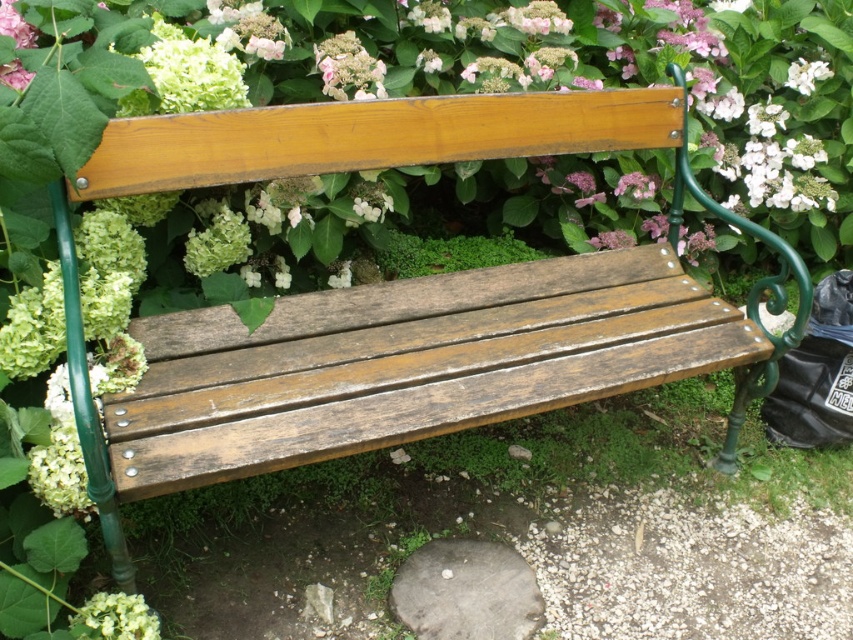
You are planning to take a photo of the wooden bench at center and the white matte flower at upper center. To ensure both are in focus, where should you position yourself relative to them?

You should position yourself in front of the wooden bench at center since it is closer to you than the white matte flower at upper center, ensuring both are in focus by focusing on the bench.

You are a gardener who wants to plant a new flower in the garden. You have two options from the image, the white matte flower at lower left and the pink matte flower at upper center. Which flower has a wider spread when fully grown?

The white matte flower at lower left has a wider spread than the pink matte flower at upper center because its width is larger according to the description.

You are standing in the garden and want to pick both the white matte flower at lower left and the pink matte flower at upper center. Which flower should you move towards first if you want to pick the one closer to your current position?

The white matte flower at lower left is to the left of the pink matte flower at upper center, so it is closer to your current position. You should move towards the white matte flower at lower left first.